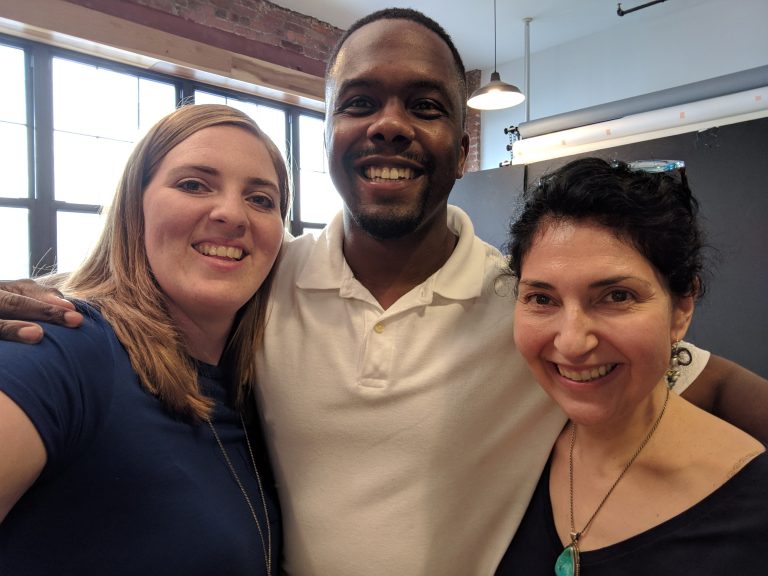
You are a GUI agent. You are given a task and a screenshot of the screen. Output one action in this format:
    pyautogui.click(x=<x>, y=<y>)
    Task: Click on the hanging light
    
    Given the screenshot: What is the action you would take?
    pyautogui.click(x=495, y=97)